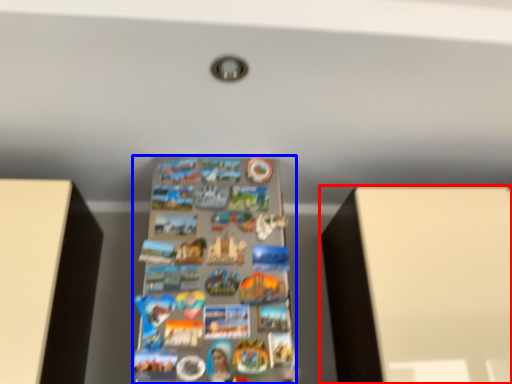
Question: Which object is further to the camera taking this photo, furniture (highlighted by a red box) or shelf (highlighted by a blue box)?

Choices:
 (A) furniture
 (B) shelf

Answer: (A)